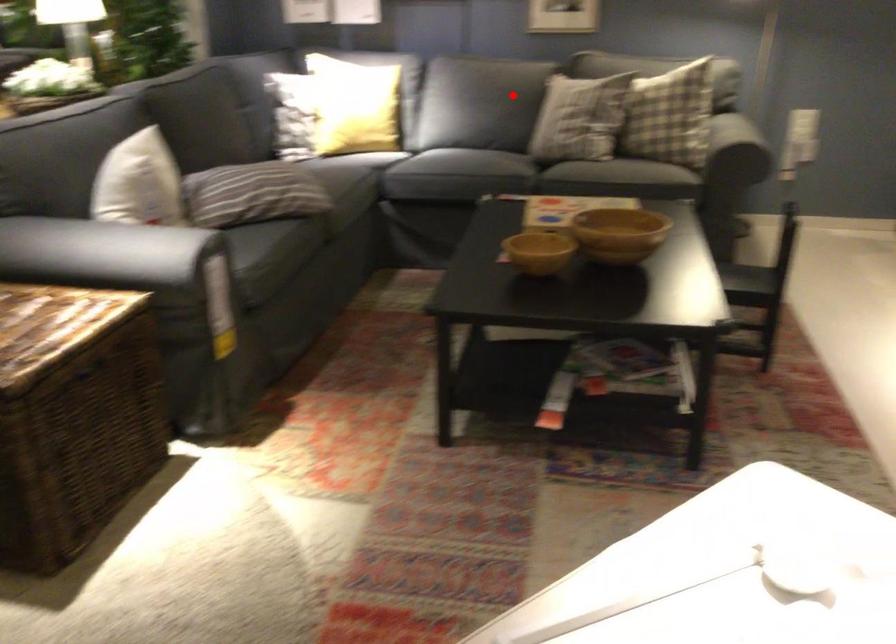
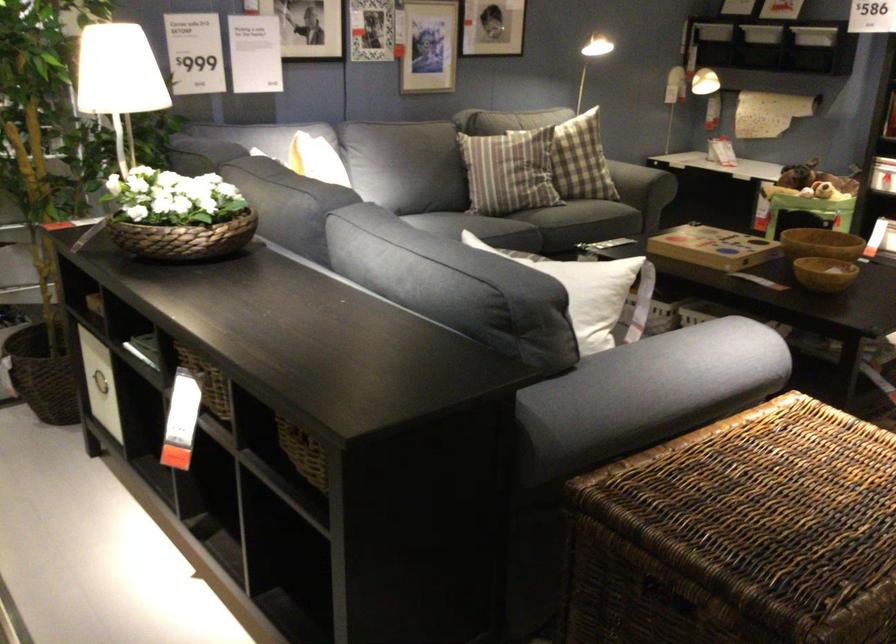
The point at the highlighted location is marked in the first image. Where is the corresponding point in the second image?

(507, 172)